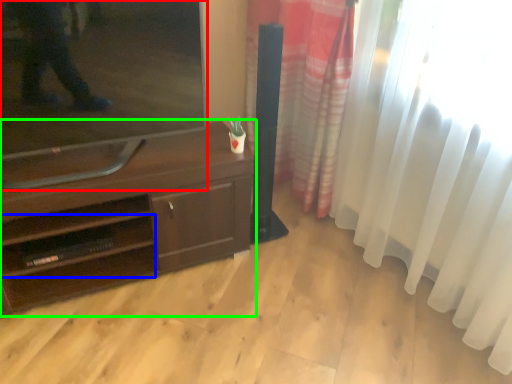
Question: Which object is positioned closest to television (highlighted by a red box)? Select from shelf (highlighted by a blue box) and desk (highlighted by a green box).

Choices:
 (A) shelf
 (B) desk

Answer: (B)